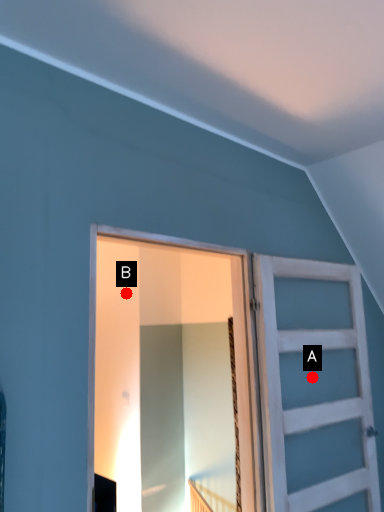
Question: Two points are circled on the image, labeled by A and B beside each circle. Among these points, which one is nearest to the camera?

Choices:
 (A) A is closer
 (B) B is closer

Answer: (A)